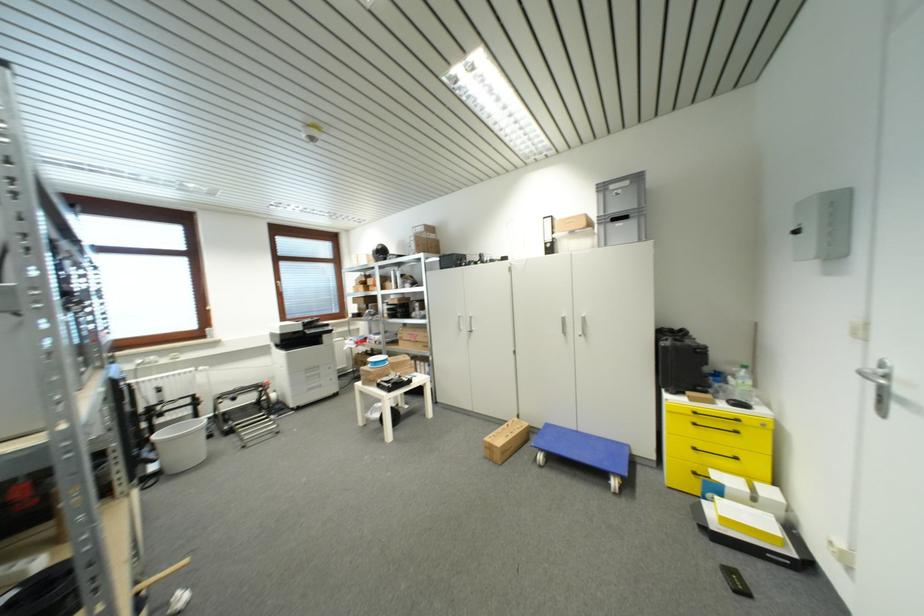
Where is `yellow drawer handle`? The height and width of the screenshot is (616, 924). yellow drawer handle is located at coordinates (897, 387).